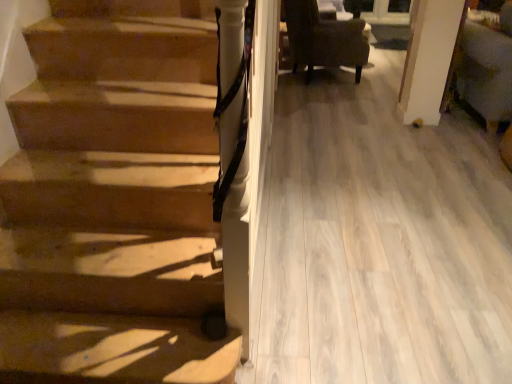
Question: Is velvet green armchair at right surrounded by dark brown fabric chair at upper right?

Choices:
 (A) yes
 (B) no

Answer: (B)

Question: From the image's perspective, is dark brown fabric chair at upper right on velvet green armchair at right?

Choices:
 (A) yes
 (B) no

Answer: (A)

Question: Is dark brown fabric chair at upper right wider than velvet green armchair at right?

Choices:
 (A) no
 (B) yes

Answer: (A)

Question: Can you confirm if dark brown fabric chair at upper right is thinner than velvet green armchair at right?

Choices:
 (A) yes
 (B) no

Answer: (A)

Question: Is dark brown fabric chair at upper right far away from velvet green armchair at right?

Choices:
 (A) no
 (B) yes

Answer: (B)

Question: Is the depth of dark brown fabric chair at upper right greater than that of velvet green armchair at right?

Choices:
 (A) yes
 (B) no

Answer: (A)

Question: Considering the relative sizes of velvet green armchair at right and dark brown fabric chair at upper right in the image provided, is velvet green armchair at right wider than dark brown fabric chair at upper right?

Choices:
 (A) no
 (B) yes

Answer: (B)

Question: From the image's perspective, would you say velvet green armchair at right is shown under dark brown fabric chair at upper right?

Choices:
 (A) yes
 (B) no

Answer: (A)

Question: Is dark brown fabric chair at upper right completely or partially inside velvet green armchair at right?

Choices:
 (A) yes
 (B) no

Answer: (B)

Question: From the image's perspective, is velvet green armchair at right above dark brown fabric chair at upper right?

Choices:
 (A) yes
 (B) no

Answer: (B)

Question: Considering the relative positions of velvet green armchair at right and dark brown fabric chair at upper right in the image provided, is velvet green armchair at right to the right of dark brown fabric chair at upper right from the viewer's perspective?

Choices:
 (A) no
 (B) yes

Answer: (B)

Question: From a real-world perspective, is velvet green armchair at right on dark brown fabric chair at upper right?

Choices:
 (A) yes
 (B) no

Answer: (A)

Question: In the image, is velvet green armchair at right positioned in front of or behind dark brown fabric chair at upper right?

Choices:
 (A) behind
 (B) front

Answer: (B)